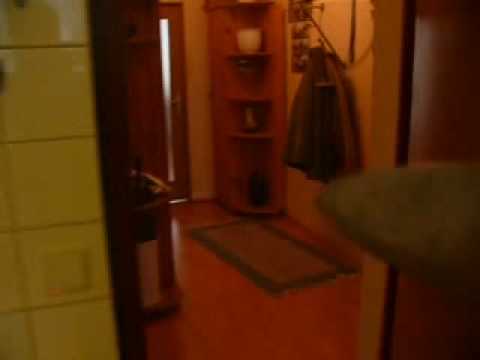
The image size is (480, 360). In order to click on seat in this screenshot , I will do `click(402, 209)`.